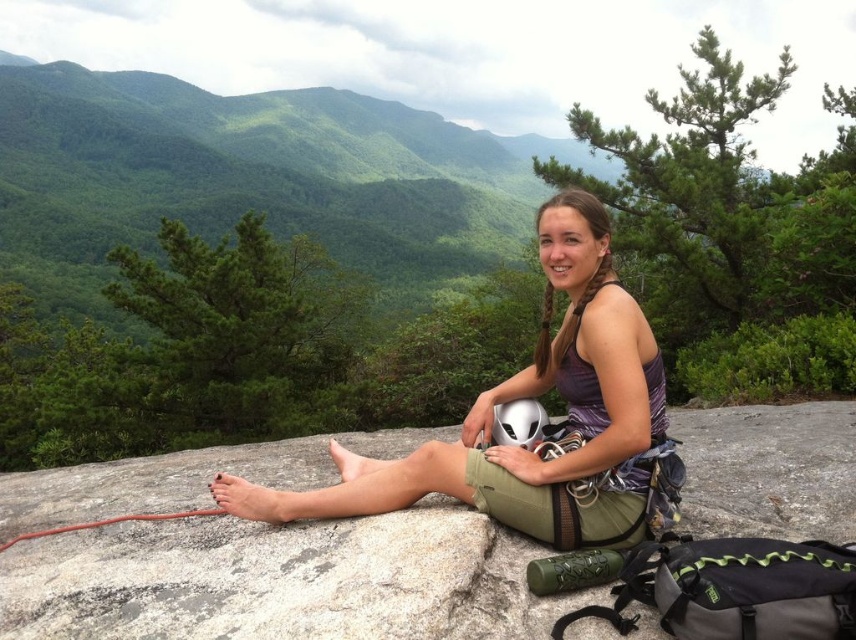
Does matte purple tank top at center appear under white matte helmet at center?

Yes, matte purple tank top at center is below white matte helmet at center.

The image size is (856, 640). Describe the element at coordinates (522, 397) in the screenshot. I see `matte purple tank top at center` at that location.

The width and height of the screenshot is (856, 640). Describe the element at coordinates (522, 397) in the screenshot. I see `matte purple tank top at center` at that location.

The width and height of the screenshot is (856, 640). I want to click on matte purple tank top at center, so click(522, 397).

Which is above, green fabric boulder at center or white matte helmet at center?

white matte helmet at center is above.

Does green fabric boulder at center appear over white matte helmet at center?

No, green fabric boulder at center is not above white matte helmet at center.

Does point (776, 531) come farther from viewer compared to point (522, 436)?

No, it is not.

Identify the location of green fabric boulder at center. (282, 580).

Does green fabric boulder at center appear on the right side of matte purple tank top at center?

Incorrect, green fabric boulder at center is not on the right side of matte purple tank top at center.

This screenshot has width=856, height=640. I want to click on green fabric boulder at center, so click(282, 580).

Is point (420, 616) less distant than point (482, 451)?

Yes, it is in front of point (482, 451).

Where is `green fabric boulder at center`? green fabric boulder at center is located at coordinates (282, 580).